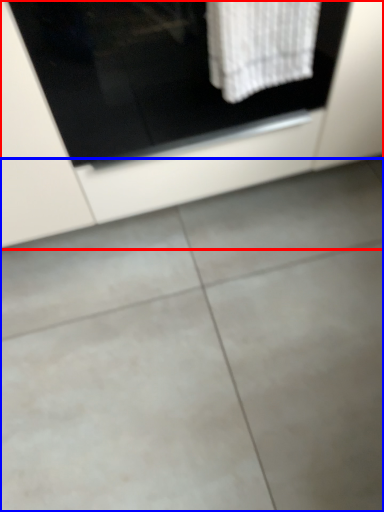
Question: Which of the following is the closest to the observer, cabinetry (highlighted by a red box) or concrete (highlighted by a blue box)?

Choices:
 (A) cabinetry
 (B) concrete

Answer: (A)